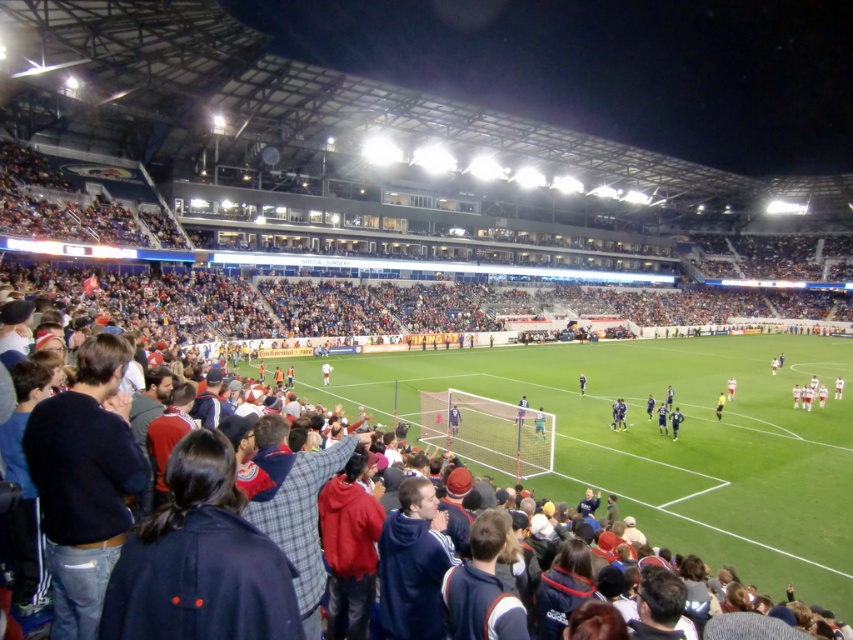
Question: Can you confirm if green jersey at center is smaller than yellow uniformed official at center?

Choices:
 (A) yes
 (B) no

Answer: (A)

Question: Which object is the farthest from the light blue jersey at center?

Choices:
 (A) dark blue jersey at center
 (B) green jersey at center

Answer: (A)

Question: Can you confirm if white jersey at center is smaller than yellow uniformed official at center?

Choices:
 (A) no
 (B) yes

Answer: (A)

Question: Estimate the real-world distances between objects in this image. Which object is closer to the dark blue jersey at center?

Choices:
 (A) yellow uniformed official at center
 (B) white fabric shirt at center

Answer: (A)

Question: Considering the real-world distances, which object is farthest from the white jersey at center?

Choices:
 (A) blue jersey at center
 (B) yellow uniformed official at center
 (C) white fabric shirt at center
 (D) green jersey at center

Answer: (C)

Question: Is green jersey at center thinner than dark blue jersey at center?

Choices:
 (A) no
 (B) yes

Answer: (A)